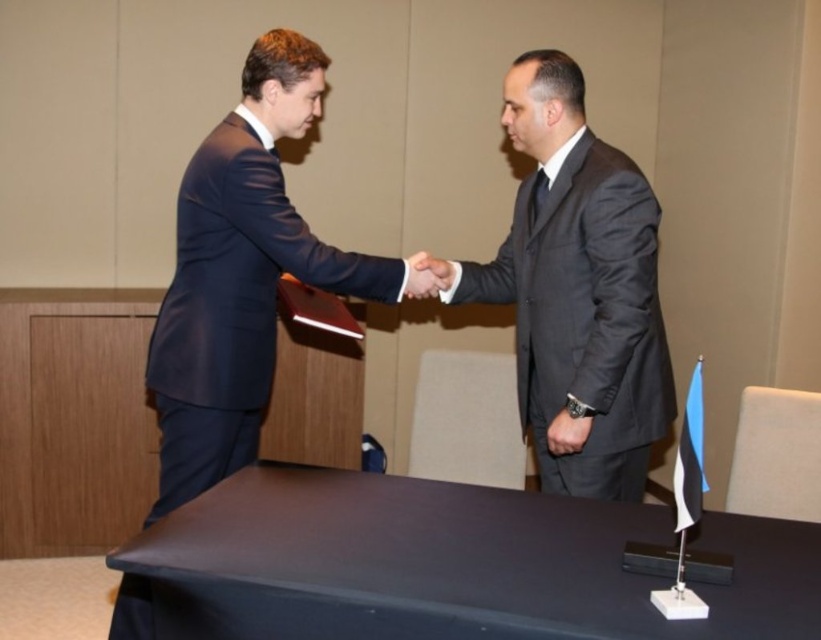
You are an observer at the event and notice the matte black hand at center and the black leather wristwatch at center. Which object is closer to you?

The matte black hand at center is closer to you because it is positioned over the black leather wristwatch at center.